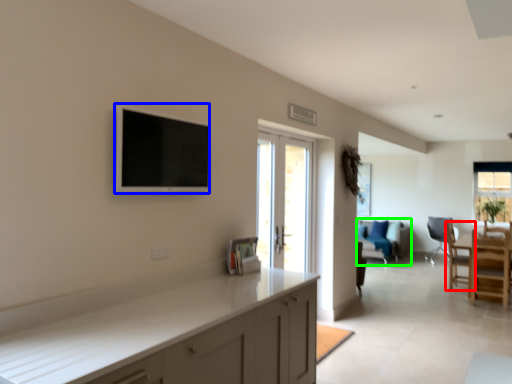
Question: Which object is the farthest from chair (highlighted by a red box)? Choose among these: flat (highlighted by a blue box) or couch (highlighted by a green box).

Choices:
 (A) flat
 (B) couch

Answer: (A)